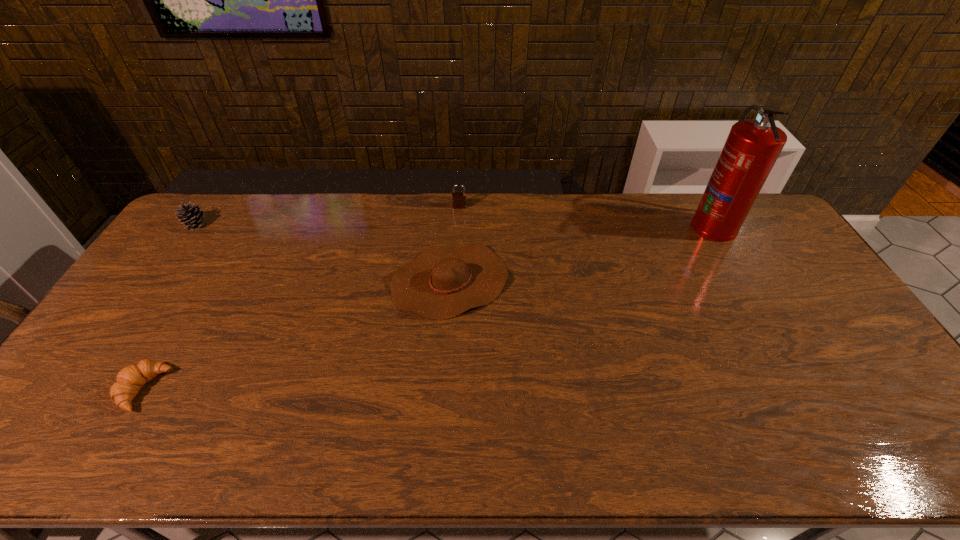
Image resolution: width=960 pixels, height=540 pixels. In order to click on the rightmost object in this screenshot , I will do `click(752, 147)`.

Find the location of a particular element. fire extinguisher is located at coordinates (752, 147).

Locate an element on the screen. padlock is located at coordinates (458, 199).

Where is `the leftmost object`? the leftmost object is located at coordinates (193, 217).

Identify the location of the second shortest object. (442, 282).

Where is `cowboy hat`? cowboy hat is located at coordinates (442, 282).

Where is `crescent roll`? crescent roll is located at coordinates (130, 379).

This screenshot has width=960, height=540. Identify the location of the nearest object. (130, 379).

Find the location of a particular element. The image size is (960, 540). vacant area situated 0.320m on the instruction side of the tallest object is located at coordinates (600, 226).

This screenshot has height=540, width=960. Identify the location of vacant space situated 0.270m on the instruction side of the tallest object. (614, 226).